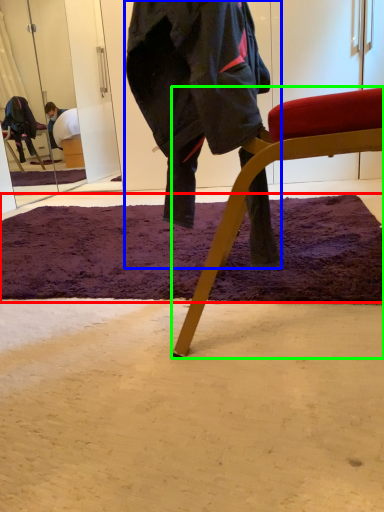
Question: Which object is the closest to the mat (highlighted by a red box)? Choose among these: person (highlighted by a blue box) or chair (highlighted by a green box).

Choices:
 (A) person
 (B) chair

Answer: (B)